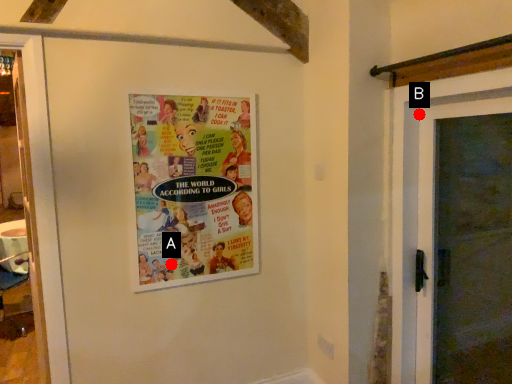
Question: Two points are circled on the image, labeled by A and B beside each circle. Which point is closer to the camera taking this photo?

Choices:
 (A) A is closer
 (B) B is closer

Answer: (B)